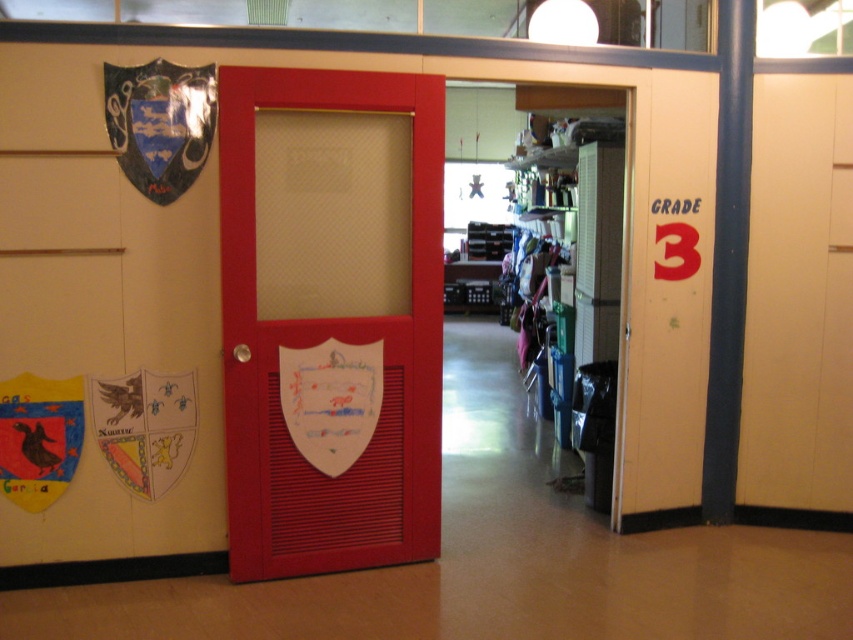
Does matte wood door at center appear on the right side of shiny metallic shield at upper left?

Correct, you'll find matte wood door at center to the right of shiny metallic shield at upper left.

Is point (236, 570) farther from camera compared to point (160, 100)?

That is True.

This screenshot has width=853, height=640. I want to click on matte wood door at center, so click(328, 320).